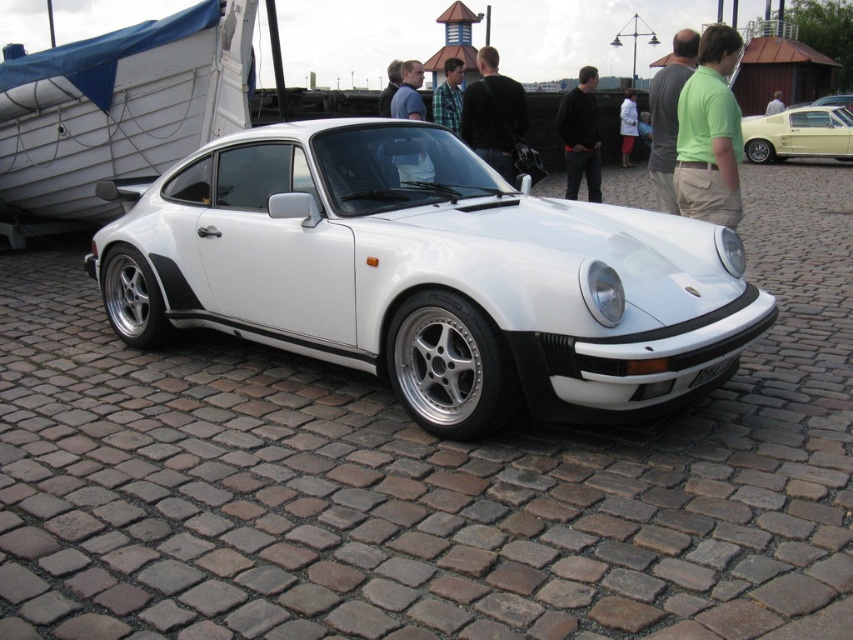
Question: Which of these objects is positioned closest to the white wood boat at left?

Choices:
 (A) dark blue shirt at center
 (B) green shirt at center

Answer: (A)

Question: Which of the following is the closest to the observer?

Choices:
 (A) green plaid shirt at center
 (B) green fabric shirt at upper right
 (C) dark blue shirt at center

Answer: (B)

Question: Can you confirm if white glossy sports car at center is positioned above white cotton shirt at center?

Choices:
 (A) yes
 (B) no

Answer: (B)

Question: Which of the following is the farthest from the observer?

Choices:
 (A) (379, 100)
 (B) (393, 97)

Answer: (A)

Question: Can you confirm if white glossy sports car at center is positioned to the right of green plaid shirt at center?

Choices:
 (A) yes
 (B) no

Answer: (B)

Question: Is light yellow matte car at upper right wider than dark blue shirt at center?

Choices:
 (A) yes
 (B) no

Answer: (A)